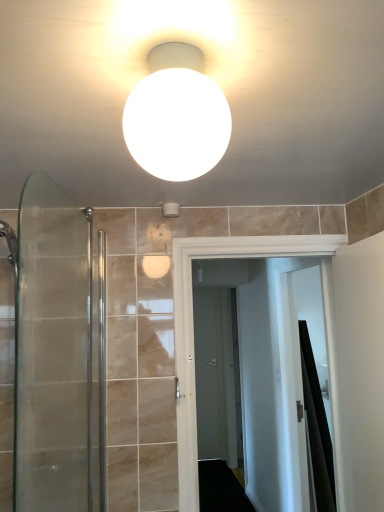
Question: From a real-world perspective, is clear glass shower door at left above or below white matte sphere at upper center?

Choices:
 (A) above
 (B) below

Answer: (B)

Question: Is clear glass shower door at left situated inside white matte sphere at upper center or outside?

Choices:
 (A) outside
 (B) inside

Answer: (A)

Question: Which object is the closest to the clear glass shower door at left?

Choices:
 (A) white matte toilet paper holder at upper center
 (B) white glossy door at center
 (C) white matte sphere at upper center
 (D) black fabric shower curtain at right
 (E) matte gray door at center

Answer: (B)

Question: Which object is the closest to the white matte toilet paper holder at upper center?

Choices:
 (A) black fabric shower curtain at right
 (B) white glossy door at center
 (C) clear glass shower door at left
 (D) white matte sphere at upper center
 (E) matte gray door at center

Answer: (B)